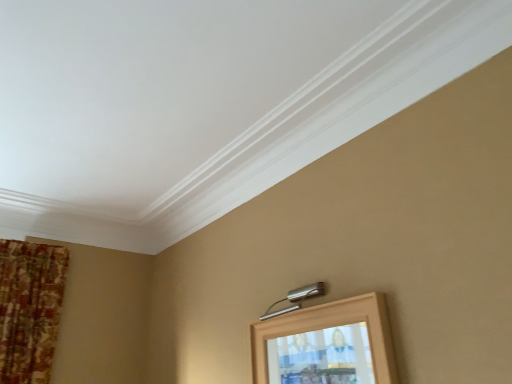
Locate an element on the screen. Image resolution: width=512 pixels, height=384 pixels. wooden picture frame at lower right is located at coordinates (329, 338).

What do you see at coordinates (329, 338) in the screenshot? The width and height of the screenshot is (512, 384). I see `wooden picture frame at lower right` at bounding box center [329, 338].

The height and width of the screenshot is (384, 512). Find the location of `wooden picture frame at lower right`. wooden picture frame at lower right is located at coordinates (329, 338).